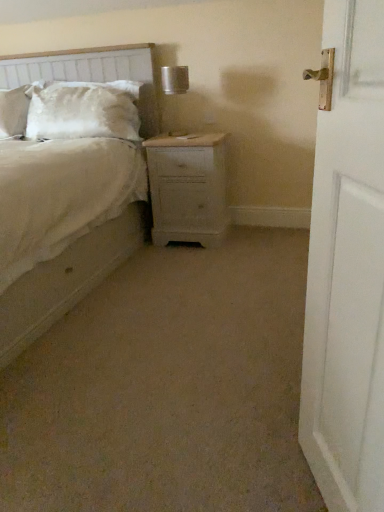
Question: Is textured fabric headboard at upper left turned away from white wooden door at right?

Choices:
 (A) yes
 (B) no

Answer: (B)

Question: From the image's perspective, is textured fabric headboard at upper left located above white wooden door at right?

Choices:
 (A) yes
 (B) no

Answer: (A)

Question: Does textured fabric headboard at upper left have a smaller size compared to white wooden door at right?

Choices:
 (A) no
 (B) yes

Answer: (A)

Question: Could you tell me if textured fabric headboard at upper left is facing white wooden door at right?

Choices:
 (A) no
 (B) yes

Answer: (A)

Question: Does textured fabric headboard at upper left have a greater width compared to white wooden door at right?

Choices:
 (A) no
 (B) yes

Answer: (B)

Question: Considering the relative sizes of textured fabric headboard at upper left and white wooden door at right in the image provided, is textured fabric headboard at upper left taller than white wooden door at right?

Choices:
 (A) yes
 (B) no

Answer: (B)

Question: Is beige fabric bed at center smaller than satin white pillow at upper left?

Choices:
 (A) no
 (B) yes

Answer: (A)

Question: Is beige fabric bed at center with satin white pillow at upper left?

Choices:
 (A) yes
 (B) no

Answer: (B)

Question: Would you say beige fabric bed at center contains satin white pillow at upper left?

Choices:
 (A) yes
 (B) no

Answer: (A)

Question: Does beige fabric bed at center have a greater height compared to satin white pillow at upper left?

Choices:
 (A) no
 (B) yes

Answer: (B)

Question: From the image's perspective, is beige fabric bed at center over satin white pillow at upper left?

Choices:
 (A) yes
 (B) no

Answer: (B)

Question: Is beige fabric bed at center not close to satin white pillow at upper left?

Choices:
 (A) yes
 (B) no

Answer: (B)

Question: Can you confirm if textured fabric headboard at upper left is thinner than light wood nightstand at center?

Choices:
 (A) yes
 (B) no

Answer: (A)